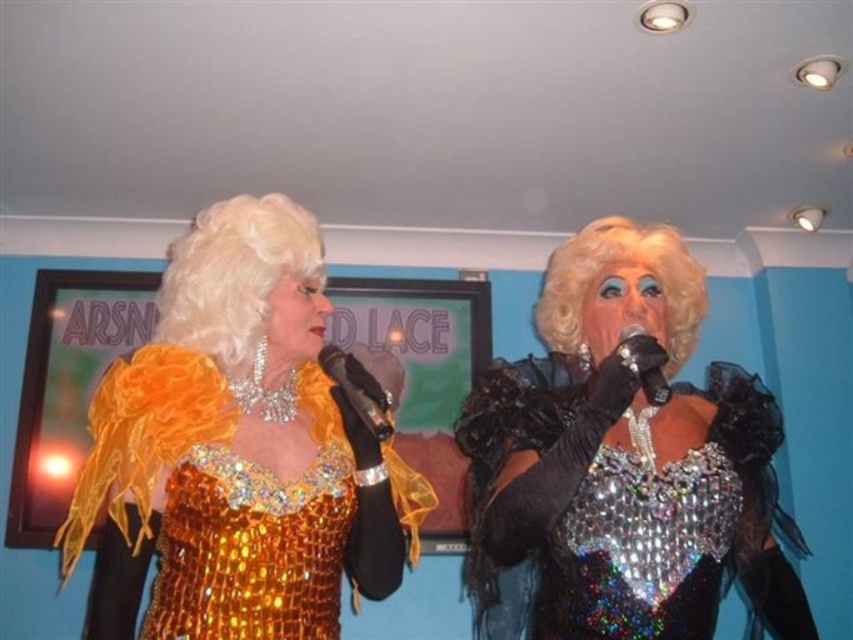
Who is positioned more to the right, blondehair/fabric wig at center or metallic silver microphone at center?

blondehair/fabric wig at center is more to the right.

Who is more forward, [579,342] or [645,358]?

Point [645,358]

Find the location of a particular element. Image resolution: width=853 pixels, height=640 pixels. blondehair/fabric wig at center is located at coordinates (618, 260).

Is sparkly silver dress at center further to camera compared to shiny blonde wig at upper left?

No, sparkly silver dress at center is in front of shiny blonde wig at upper left.

Can you confirm if sparkly silver dress at center is positioned to the left of shiny blonde wig at upper left?

In fact, sparkly silver dress at center is to the right of shiny blonde wig at upper left.

Does point (766, 524) come farther from viewer compared to point (218, 212)?

No, (766, 524) is closer to viewer.

I want to click on sparkly silver dress at center, so click(624, 465).

Does shiny gold dress at left have a greater height compared to sparkly silver dress at center?

In fact, shiny gold dress at left may be shorter than sparkly silver dress at center.

Does shiny gold dress at left appear over sparkly silver dress at center?

Indeed, shiny gold dress at left is positioned over sparkly silver dress at center.

You are a GUI agent. You are given a task and a screenshot of the screen. Output one action in this format:
    pyautogui.click(x=<x>, y=<y>)
    Task: Click on the shiny gold dress at left
    The image size is (853, 640).
    Given the screenshot: What is the action you would take?
    pyautogui.click(x=238, y=451)

Find the location of a particular element. The height and width of the screenshot is (640, 853). shiny gold dress at left is located at coordinates (238, 451).